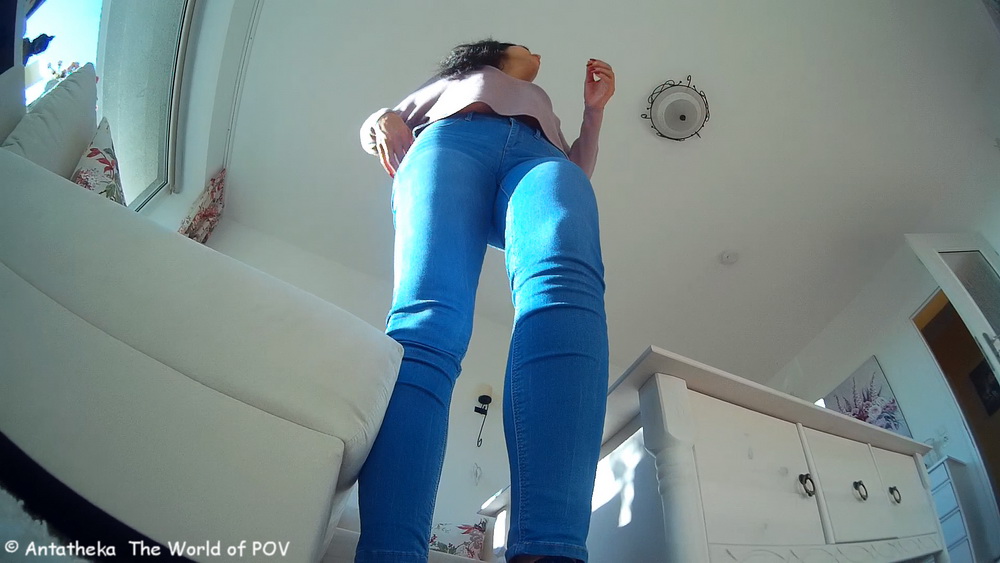
Where is `ceiling`? The height and width of the screenshot is (563, 1000). ceiling is located at coordinates (836, 151).